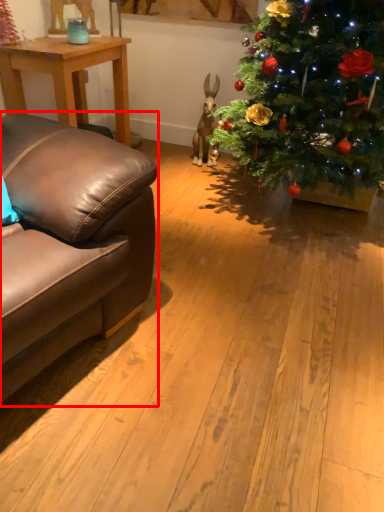
Question: From the image's perspective, considering the relative positions of studio couch (annotated by the red box) and table in the image provided, where is studio couch (annotated by the red box) located with respect to the staircase?

Choices:
 (A) above
 (B) below

Answer: (B)